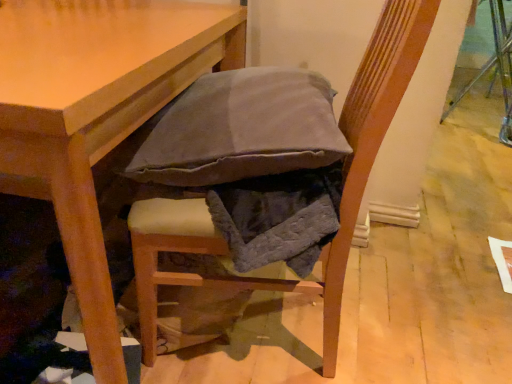
Question: In terms of height, does light brown wooden table at center look taller or shorter compared to textured fabric cushion at center?

Choices:
 (A) short
 (B) tall

Answer: (A)

Question: Based on their sizes in the image, would you say light brown wooden table at center is bigger or smaller than textured fabric cushion at center?

Choices:
 (A) big
 (B) small

Answer: (A)

Question: From a real-world perspective, is light brown wooden table at center above or below textured fabric cushion at center?

Choices:
 (A) below
 (B) above

Answer: (A)

Question: In the image, is textured fabric cushion at center positioned in front of or behind light brown wooden table at center?

Choices:
 (A) behind
 (B) front

Answer: (A)

Question: From the image's perspective, relative to light brown wooden table at center, is textured fabric cushion at center above or below?

Choices:
 (A) below
 (B) above

Answer: (A)

Question: Does point (187, 281) appear closer or farther from the camera than point (53, 127)?

Choices:
 (A) farther
 (B) closer

Answer: (A)

Question: Considering the positions of textured fabric cushion at center and light brown wooden table at center in the image, is textured fabric cushion at center bigger or smaller than light brown wooden table at center?

Choices:
 (A) big
 (B) small

Answer: (B)